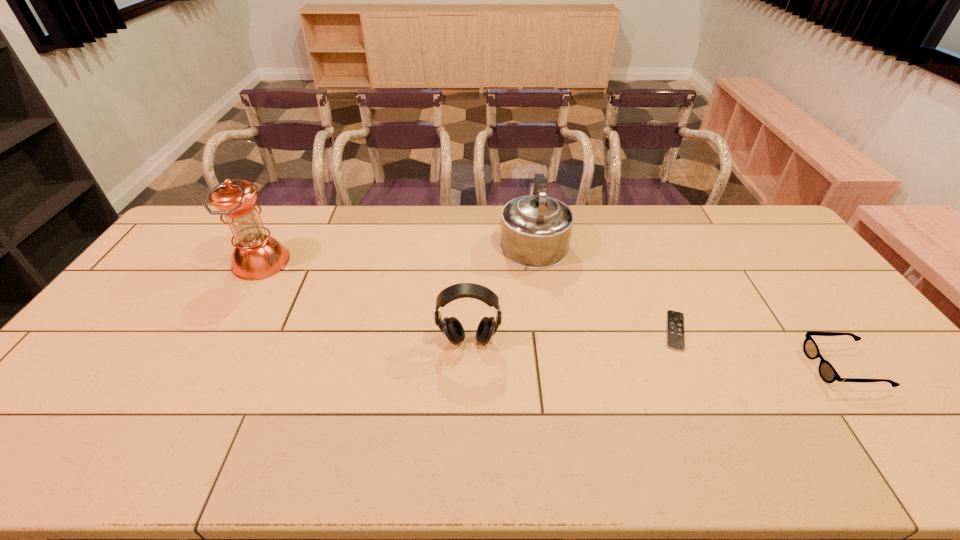
What are the coordinates of `vacant area situated on the front of the tallest object` in the screenshot? It's located at (241, 297).

The width and height of the screenshot is (960, 540). What are the coordinates of `free point located with the spout at the front of the third object from right to left` in the screenshot? It's located at (528, 206).

This screenshot has width=960, height=540. Identify the location of free space located 0.310m on the ear cups of the second object from left to right. (466, 465).

You are a GUI agent. You are given a task and a screenshot of the screen. Output one action in this format:
    pyautogui.click(x=<x>, y=<y>)
    Task: Click on the vacant region located on the arms of the rightmost object
    The width and height of the screenshot is (960, 540).
    Given the screenshot: What is the action you would take?
    pyautogui.click(x=709, y=367)

I want to click on vacant position located 0.080m on the arms of the rightmost object, so click(x=782, y=367).

Locate an element on the screen. vacant region located on the arms of the rightmost object is located at coordinates (732, 367).

This screenshot has width=960, height=540. In order to click on vacant space located 0.390m on the left of the second object from right to left in this screenshot , I will do `click(522, 330)`.

Identify the location of object at the far edge. This screenshot has height=540, width=960. (535, 230).

I want to click on object present at the right edge, so click(828, 374).

In the image, there is a desktop. Identify the location of vacant space at the far edge. (305, 241).